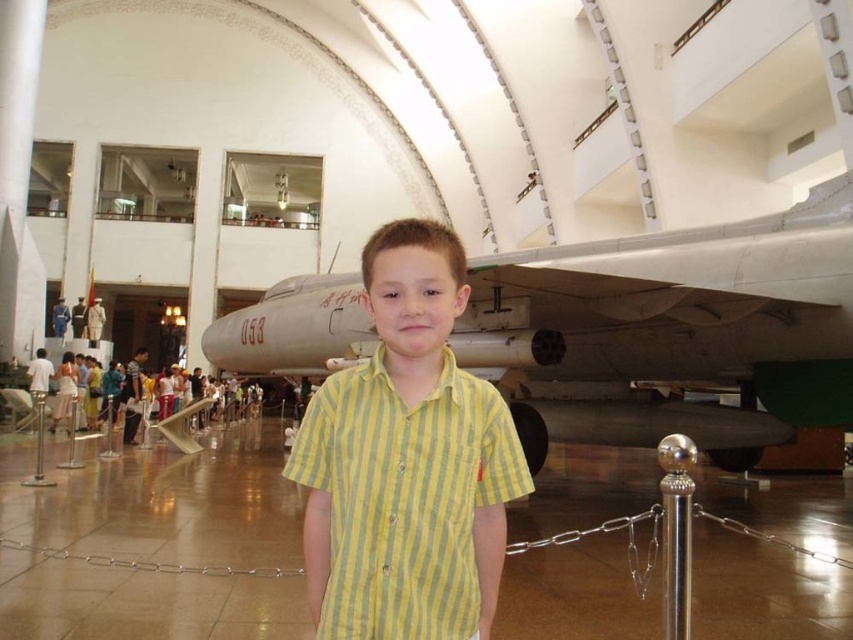
Question: Which object appears farthest from the camera in this image?

Choices:
 (A) yellow striped shirt at center
 (B) silver metallic airplane at center

Answer: (B)

Question: Is silver metallic airplane at center to the left of yellow striped shirt at center from the viewer's perspective?

Choices:
 (A) yes
 (B) no

Answer: (B)

Question: Which point is closer to the camera?

Choices:
 (A) yellow striped shirt at center
 (B) silver metallic airplane at center

Answer: (A)

Question: Does silver metallic airplane at center have a smaller size compared to yellow striped shirt at center?

Choices:
 (A) yes
 (B) no

Answer: (B)

Question: Is silver metallic airplane at center bigger than yellow striped shirt at center?

Choices:
 (A) no
 (B) yes

Answer: (B)

Question: Which point is closer to the camera taking this photo?

Choices:
 (A) (305, 316)
 (B) (350, 412)

Answer: (B)